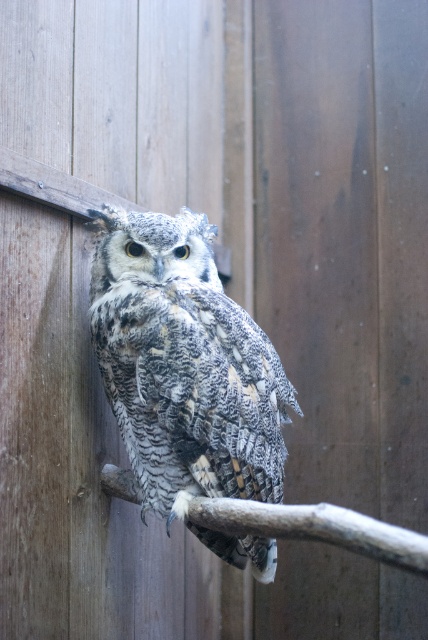
You are an ornithologist observing the speckled feathered owl at center and the smooth brown branch at center in the image. Which object is positioned more to the right?

The smooth brown branch at center is positioned more to the right than the speckled feathered owl at center.

Based on the coordinates provided in the image, where is the speckled feathered owl at center positioned?

The speckled feathered owl at center is located at point (184, 365).